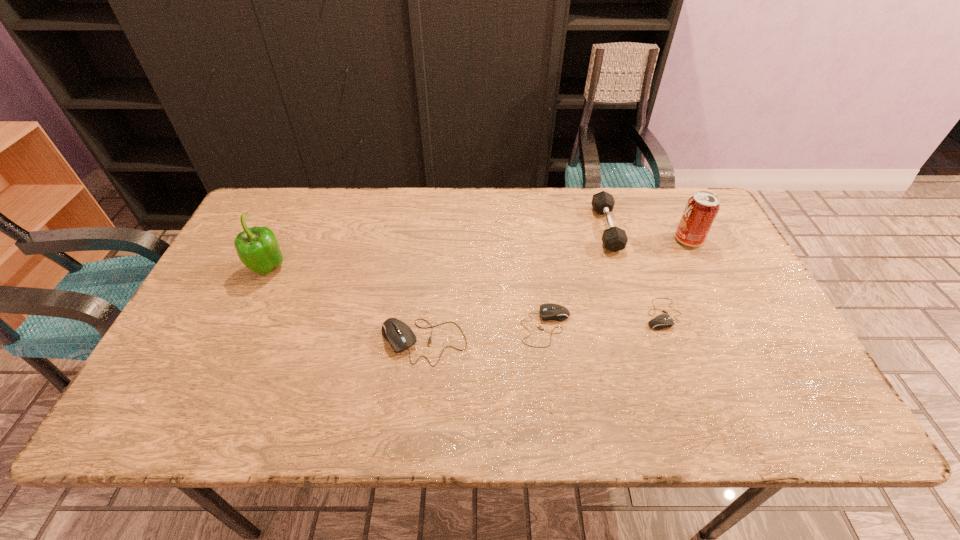
Identify which computer mouse is the nearest to the dumbbell. Please provide its 2D coordinates. Your answer should be formatted as a tuple, i.e. [(x, y)], where the tuple contains the x and y coordinates of a point satisfying the conditions above.

[(661, 321)]

This screenshot has height=540, width=960. Find the location of `computer mouse that is the second closest to the second tallest computer mouse`. computer mouse that is the second closest to the second tallest computer mouse is located at coordinates (661, 321).

Where is `vacant area in the image that satisfies the following two spatial constraints: 1. on the back side of the dumbbell; 2. on the left side of the tallest computer mouse`? vacant area in the image that satisfies the following two spatial constraints: 1. on the back side of the dumbbell; 2. on the left side of the tallest computer mouse is located at coordinates (436, 228).

The image size is (960, 540). Find the location of `vacant space that satisfies the following two spatial constraints: 1. on the back side of the shortest object; 2. on the left side of the soda can`. vacant space that satisfies the following two spatial constraints: 1. on the back side of the shortest object; 2. on the left side of the soda can is located at coordinates (636, 240).